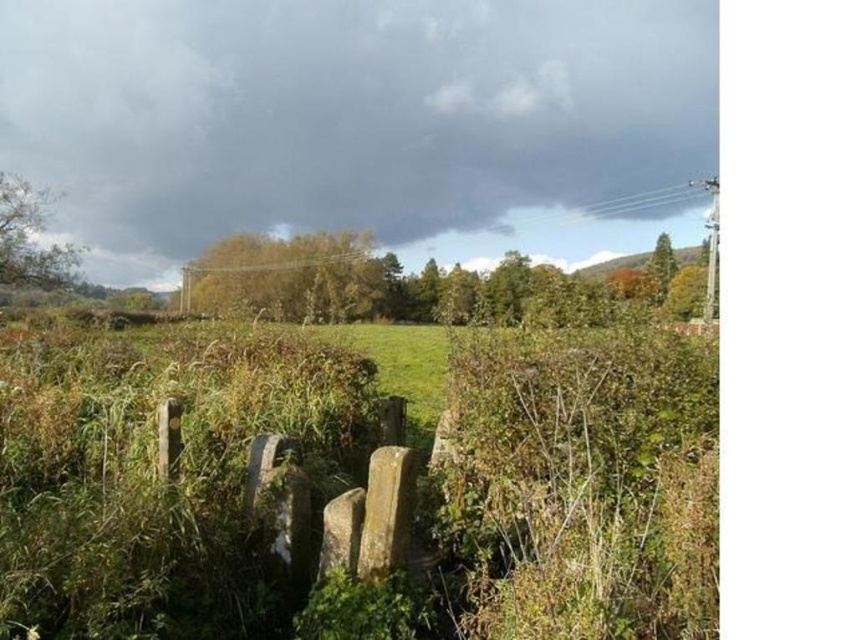
Question: Does yellow-green foliage at upper center have a lesser width compared to green leafy tree at upper left?

Choices:
 (A) no
 (B) yes

Answer: (A)

Question: Can you confirm if green leafy tree at upper left is positioned above green leafy tree at upper right?

Choices:
 (A) no
 (B) yes

Answer: (B)

Question: Is green leafy tree at upper left below green leafy tree at upper right?

Choices:
 (A) no
 (B) yes

Answer: (A)

Question: Which object appears farthest from the camera in this image?

Choices:
 (A) green leafy tree at center
 (B) yellow-green foliage at upper center
 (C) green leafy tree at upper left

Answer: (B)

Question: Among these objects, which one is nearest to the camera?

Choices:
 (A) yellow-green foliage at upper center
 (B) green leafy tree at upper right
 (C) green leafy tree at center

Answer: (C)

Question: Which is nearer to the green leafy tree at upper left?

Choices:
 (A) yellow-green foliage at upper center
 (B) green leafy tree at center
 (C) green leafy tree at upper right

Answer: (B)